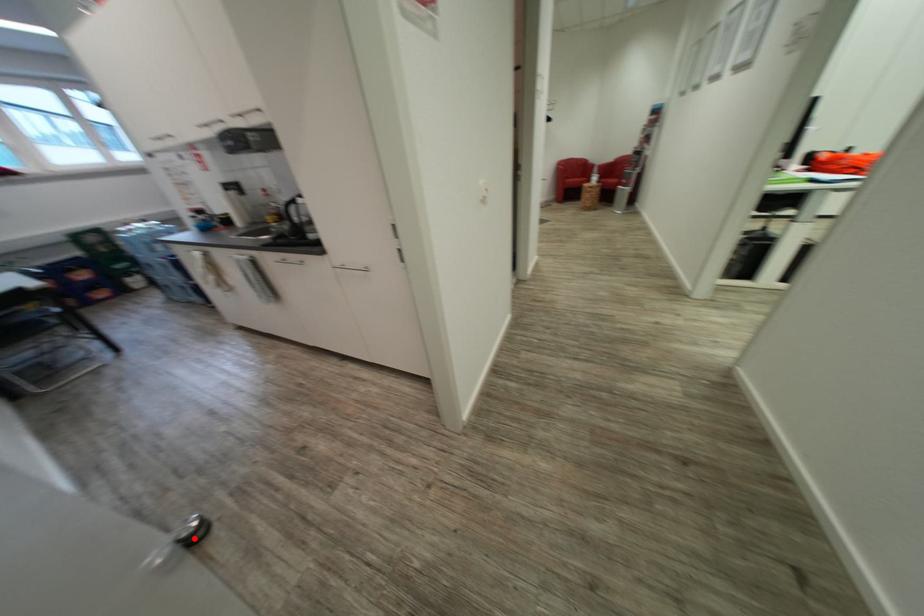
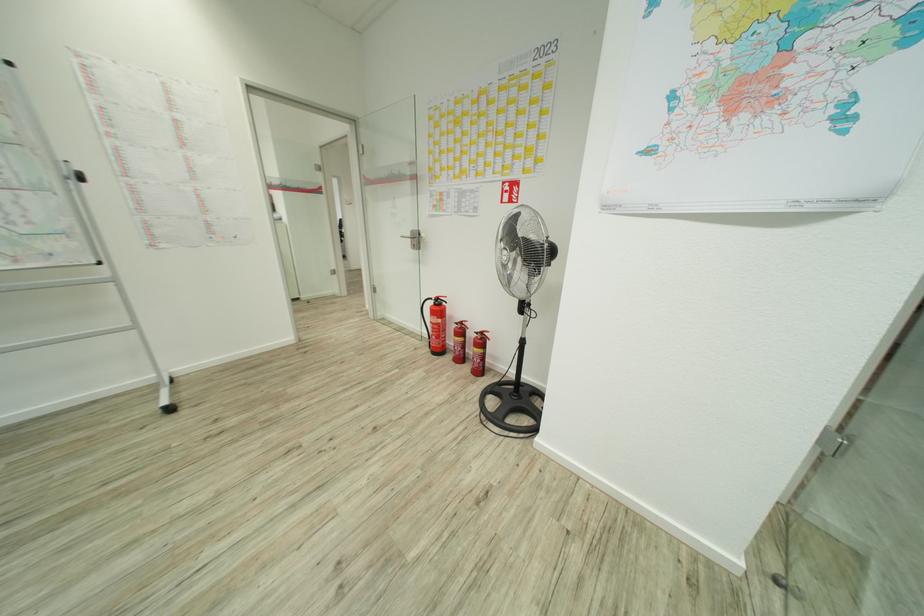
Question: I am providing you with two images of the same scene from different viewpoints. A red point is marked on the first image. Is the red point's position out of view in image 2?

Choices:
 (A) Yes
 (B) No

Answer: (A)